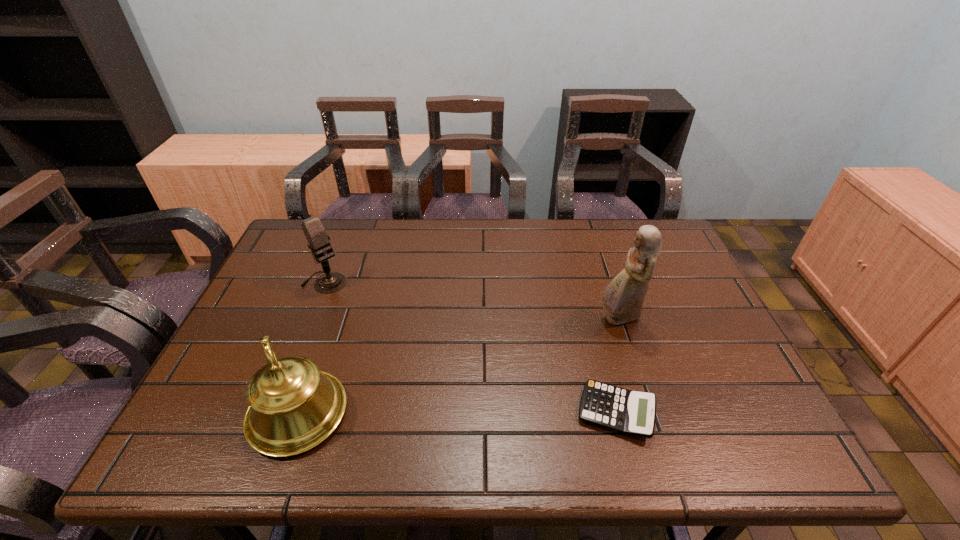
Where is `vacant space at the far left corner of the desktop`? The width and height of the screenshot is (960, 540). vacant space at the far left corner of the desktop is located at coordinates (291, 235).

Find the location of a particular element. The image size is (960, 540). free space between the calculator and the third nearest object is located at coordinates (617, 365).

The height and width of the screenshot is (540, 960). What are the coordinates of `vacant space that's between the calculator and the microphone` in the screenshot? It's located at (470, 347).

Identify the location of vacant region between the farthest object and the bell. (311, 348).

At what (x,y) coordinates should I click in order to perform the action: click on free area in between the figurine and the farthest object. Please return your answer as a coordinate pair (x, y). The height and width of the screenshot is (540, 960). Looking at the image, I should click on (471, 300).

The height and width of the screenshot is (540, 960). In order to click on vacant space that is in between the calculator and the bell in this screenshot , I will do `click(457, 413)`.

Image resolution: width=960 pixels, height=540 pixels. In order to click on empty location between the shortest object and the microphone in this screenshot , I will do `click(470, 347)`.

The image size is (960, 540). Find the location of `vacant space that's between the tallest object and the bell`. vacant space that's between the tallest object and the bell is located at coordinates (458, 366).

The image size is (960, 540). I want to click on empty space that is in between the figurine and the microphone, so click(471, 300).

You are a GUI agent. You are given a task and a screenshot of the screen. Output one action in this format:
    pyautogui.click(x=<x>, y=<y>)
    Task: Click on the vacant space that is in between the tallest object and the bell
    The image size is (960, 540).
    Given the screenshot: What is the action you would take?
    pyautogui.click(x=458, y=366)